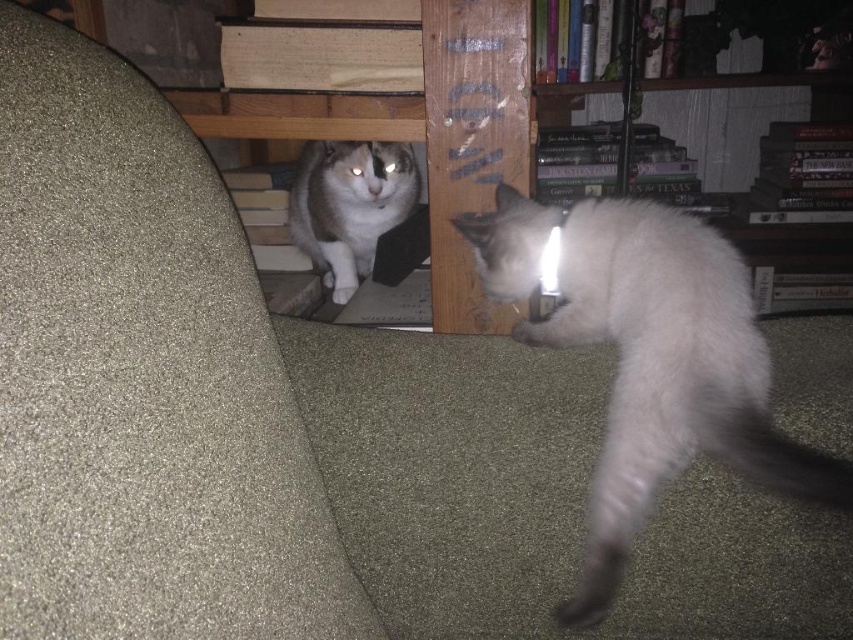
Can you confirm if white fur cat at lower right is positioned to the right of gray fur tail at lower right?

Incorrect, white fur cat at lower right is not on the right side of gray fur tail at lower right.

Can you confirm if white fur cat at lower right is positioned below gray fur tail at lower right?

Actually, white fur cat at lower right is above gray fur tail at lower right.

This screenshot has width=853, height=640. Identify the location of white fur cat at lower right. (650, 358).

Find the location of a particular element. white fur cat at lower right is located at coordinates (650, 358).

Consider the image. Is gray fur cat at center further to camera compared to gray fur tail at lower right?

Yes, it is.

Can you confirm if gray fur cat at center is shorter than gray fur tail at lower right?

No, gray fur cat at center is not shorter than gray fur tail at lower right.

Measure the distance between gray fur cat at center and camera.

gray fur cat at center and camera are 4.73 feet apart from each other.

Where is `gray fur cat at center`? gray fur cat at center is located at coordinates (349, 205).

In the scene shown: Is white fur cat at lower right shorter than gray fur cat at center?

Incorrect, white fur cat at lower right's height does not fall short of gray fur cat at center's.

Is the position of white fur cat at lower right less distant than that of gray fur cat at center?

Yes, white fur cat at lower right is closer to the viewer.

Consider the image. Measure the distance between point (508, 278) and camera.

They are 84.58 centimeters apart.

The width and height of the screenshot is (853, 640). I want to click on white fur cat at lower right, so click(650, 358).